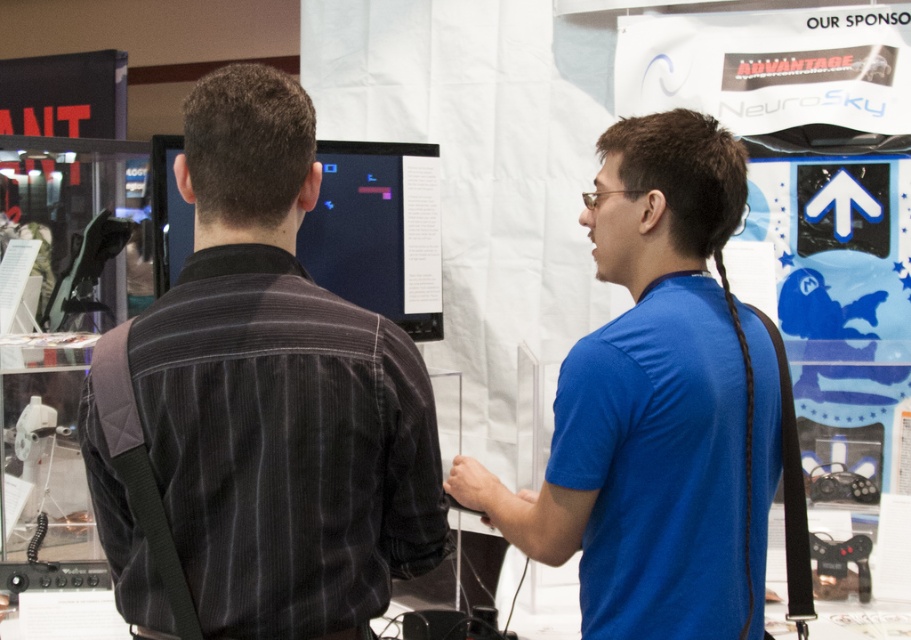
Who is positioned more to the right, dark gray corduroy shirt at center or blue cotton shirt at center?

blue cotton shirt at center is more to the right.

Is point (375, 417) more distant than point (608, 380)?

No, (375, 417) is closer to viewer.

Does point (283, 538) lie in front of point (670, 336)?

That is True.

Where is `dark gray corduroy shirt at center`? The image size is (911, 640). dark gray corduroy shirt at center is located at coordinates (267, 403).